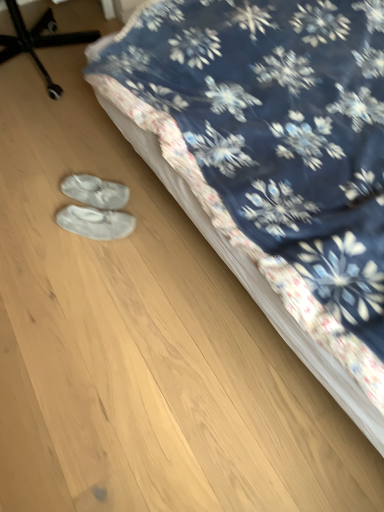
Where is `unoccupied region to the right of white fabric shoe covers at lower left, which ranks as the first footwear in top-to-bottom order`? unoccupied region to the right of white fabric shoe covers at lower left, which ranks as the first footwear in top-to-bottom order is located at coordinates (146, 196).